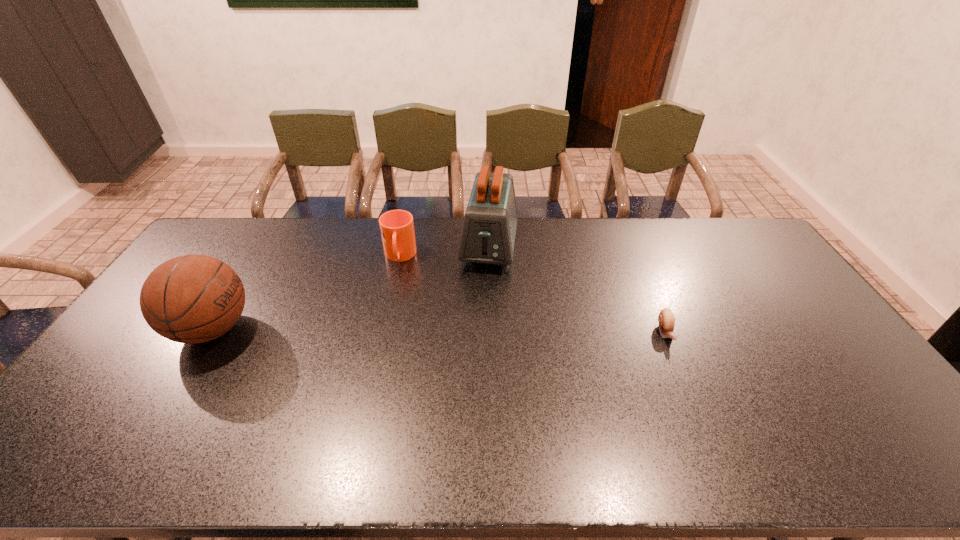
Locate an element on the screen. The height and width of the screenshot is (540, 960). vacant space situated on the handle side of the mug is located at coordinates (397, 298).

Image resolution: width=960 pixels, height=540 pixels. What are the coordinates of `vacant space located on the handle side of the mug` in the screenshot? It's located at (396, 335).

Identify the location of free spot located on the handle side of the mug. (x=396, y=313).

Identify the location of vacant space located 0.210m on the front-facing side of the tallest object. This screenshot has width=960, height=540. (477, 320).

At what (x,y) coordinates should I click in order to perform the action: click on vacant space located on the front-facing side of the tallest object. Please return your answer as a coordinate pair (x, y). Looking at the image, I should click on (478, 315).

Find the location of `vacant space located on the front-facing side of the tallest object`. vacant space located on the front-facing side of the tallest object is located at coordinates (479, 313).

Image resolution: width=960 pixels, height=540 pixels. Identify the location of mug that is at the far edge. (397, 230).

Where is `toaster located at the far edge`? Image resolution: width=960 pixels, height=540 pixels. toaster located at the far edge is located at coordinates (488, 234).

Locate an element on the screen. object that is at the left edge is located at coordinates tap(190, 299).

Find the location of a particular element. The height and width of the screenshot is (540, 960). free space at the far edge is located at coordinates (276, 225).